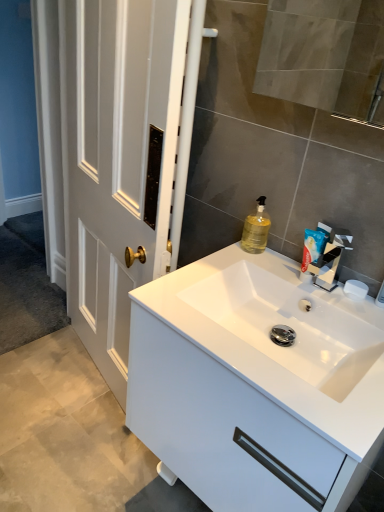
Question: Is silver metallic tap at upper right far from white plastic toothpaste tube at upper right?

Choices:
 (A) no
 (B) yes

Answer: (A)

Question: Is silver metallic tap at upper right at the left side of white plastic toothpaste tube at upper right?

Choices:
 (A) no
 (B) yes

Answer: (A)

Question: From a real-world perspective, does silver metallic tap at upper right sit lower than white plastic toothpaste tube at upper right?

Choices:
 (A) yes
 (B) no

Answer: (B)

Question: From the image's perspective, does silver metallic tap at upper right appear lower than white plastic toothpaste tube at upper right?

Choices:
 (A) yes
 (B) no

Answer: (A)

Question: Does silver metallic tap at upper right have a lesser width compared to white plastic toothpaste tube at upper right?

Choices:
 (A) yes
 (B) no

Answer: (B)

Question: From a real-world perspective, is silver metallic tap at upper right positioned over white plastic toothpaste tube at upper right based on gravity?

Choices:
 (A) yes
 (B) no

Answer: (A)

Question: From a real-world perspective, is white matte soap at right positioned over white plastic toothpaste tube at upper right based on gravity?

Choices:
 (A) yes
 (B) no

Answer: (B)

Question: Considering the relative positions of white matte soap at right and white plastic toothpaste tube at upper right in the image provided, is white matte soap at right to the left of white plastic toothpaste tube at upper right from the viewer's perspective?

Choices:
 (A) no
 (B) yes

Answer: (A)

Question: Does white matte soap at right have a lesser height compared to white plastic toothpaste tube at upper right?

Choices:
 (A) yes
 (B) no

Answer: (A)

Question: Does white matte soap at right turn towards white plastic toothpaste tube at upper right?

Choices:
 (A) no
 (B) yes

Answer: (A)

Question: Is white plastic toothpaste tube at upper right a part of white matte soap at right?

Choices:
 (A) yes
 (B) no

Answer: (B)

Question: Is white matte soap at right not inside white plastic toothpaste tube at upper right?

Choices:
 (A) yes
 (B) no

Answer: (A)

Question: Is white matte soap at right facing away from translucent yellow liquid at sink right?

Choices:
 (A) yes
 (B) no

Answer: (B)